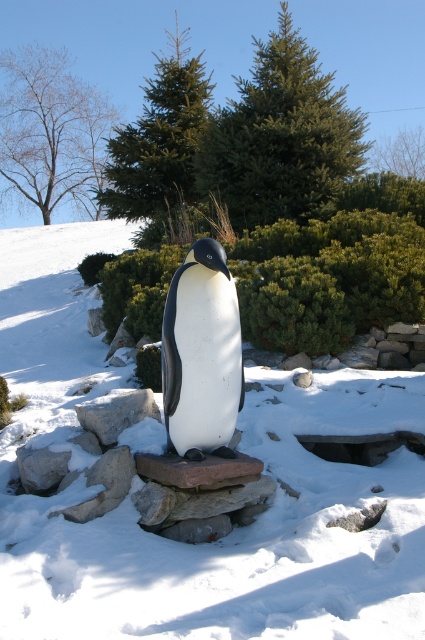
Question: Which of the following is the farthest from the observer?

Choices:
 (A) white matte penguin at center
 (B) white snow at center

Answer: (A)

Question: Estimate the real-world distances between objects in this image. Which object is farther from the white matte penguin at center?

Choices:
 (A) gray stone at center
 (B) white snow at center

Answer: (B)

Question: Is white snow at center above gray stone at center?

Choices:
 (A) no
 (B) yes

Answer: (B)

Question: Which object is positioned farthest from the white matte penguin at center?

Choices:
 (A) gray stone at center
 (B) white snow at center

Answer: (B)

Question: Does white matte penguin at center come in front of gray stone at center?

Choices:
 (A) no
 (B) yes

Answer: (B)

Question: Is white snow at center to the left of white matte penguin at center from the viewer's perspective?

Choices:
 (A) yes
 (B) no

Answer: (A)